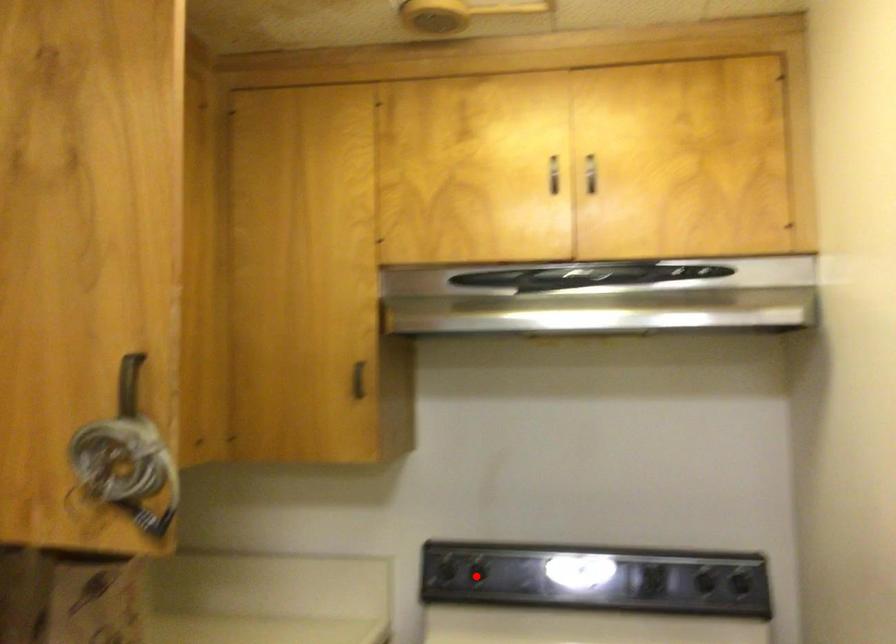
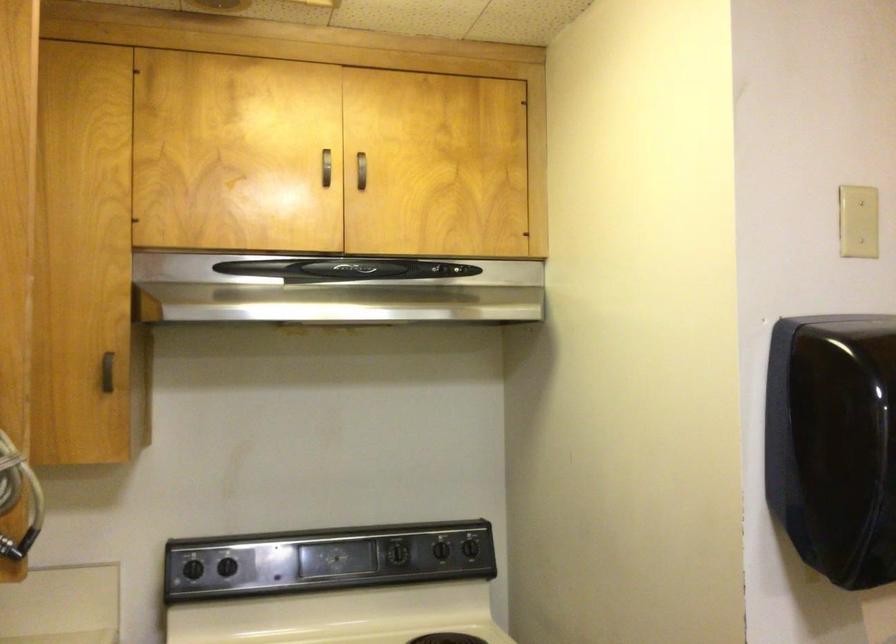
The point at the highlighted location is marked in the first image. Where is the corresponding point in the second image?

(227, 567)